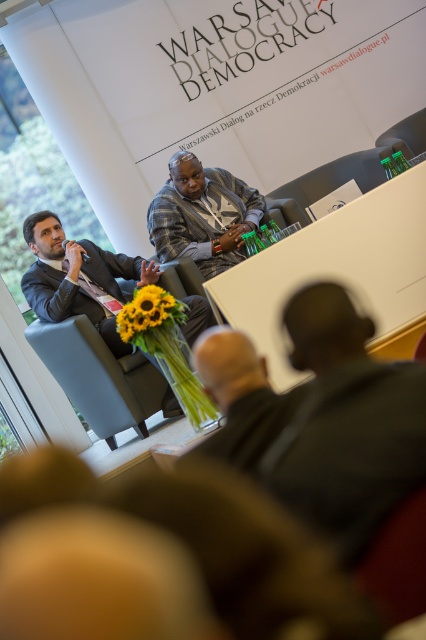
Question: Does dark gray shirt at center appear over dark gray suit at center?

Choices:
 (A) no
 (B) yes

Answer: (A)

Question: Among these points, which one is farthest from the camera?

Choices:
 (A) (314, 188)
 (B) (69, 356)
 (C) (164, 250)

Answer: (A)

Question: Is matte black suit at left wider than green fabric chair at upper center?

Choices:
 (A) yes
 (B) no

Answer: (B)

Question: Is blue fabric chair at center smaller than dark gray suit at center?

Choices:
 (A) no
 (B) yes

Answer: (A)

Question: Among these objects, which one is farthest from the camera?

Choices:
 (A) matte black suit at left
 (B) green fabric chair at upper center
 (C) blue fabric chair at center
 (D) dark gray suit at center

Answer: (B)

Question: Based on their relative distances, which object is nearer to the dark gray shirt at center?

Choices:
 (A) green fabric chair at upper center
 (B) dark gray suit at center
 (C) matte black suit at left
 (D) blue fabric chair at center

Answer: (C)